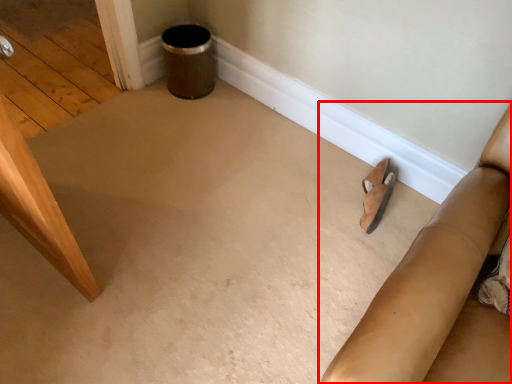
Question: From the image's perspective, what is the correct spatial positioning of furniture (annotated by the red box) in reference to footwear?

Choices:
 (A) above
 (B) below

Answer: (B)